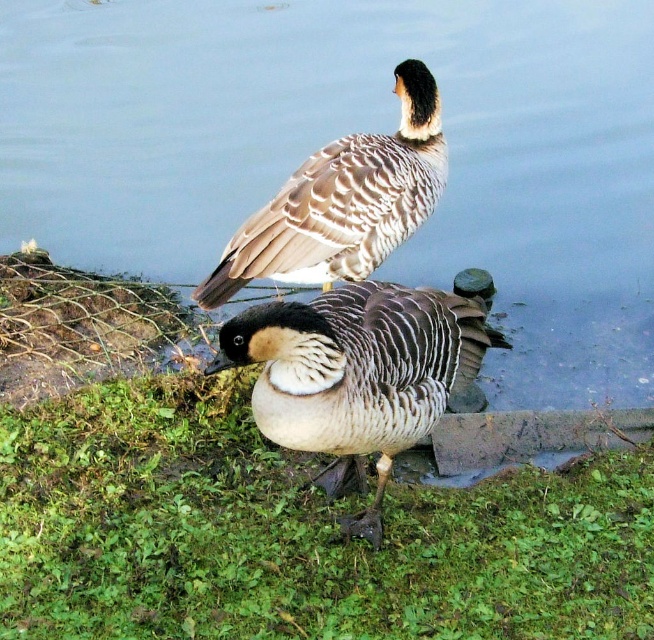
Question: Which object is positioned closest to the brown speckled duck at upper center?

Choices:
 (A) white-feathered duck at center
 (B) green grass at lower center

Answer: (A)

Question: Does white-feathered duck at center appear on the right side of brown speckled duck at upper center?

Choices:
 (A) no
 (B) yes

Answer: (B)

Question: Is white-feathered duck at center above brown speckled duck at upper center?

Choices:
 (A) yes
 (B) no

Answer: (B)

Question: Which object is the closest to the white-feathered duck at center?

Choices:
 (A) green grass at lower center
 (B) brown speckled duck at upper center

Answer: (A)

Question: Observing the image, what is the correct spatial positioning of white-feathered duck at center in reference to brown speckled duck at upper center?

Choices:
 (A) above
 (B) below

Answer: (B)

Question: Which point is farther from the camera taking this photo?

Choices:
 (A) (419, 301)
 (B) (296, 221)

Answer: (B)